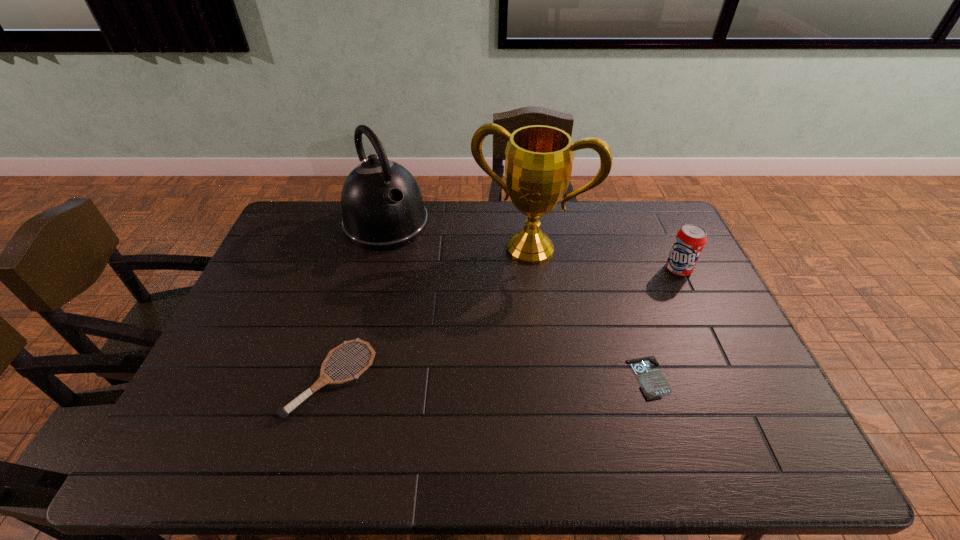
Where is `tennis racket that is positioned at the near edge`? The image size is (960, 540). tennis racket that is positioned at the near edge is located at coordinates (283, 412).

Locate an element on the screen. The width and height of the screenshot is (960, 540). identity card located at the near edge is located at coordinates (654, 385).

Where is `object located in the right edge section of the desktop`? The image size is (960, 540). object located in the right edge section of the desktop is located at coordinates (690, 240).

In the image, there is a desktop. Where is `vacant area at the far edge`? This screenshot has height=540, width=960. vacant area at the far edge is located at coordinates (517, 230).

The image size is (960, 540). Find the location of `free spot at the near edge of the desktop`. free spot at the near edge of the desktop is located at coordinates (296, 420).

Where is `vacant point at the left edge`? This screenshot has width=960, height=540. vacant point at the left edge is located at coordinates (267, 254).

In the image, there is a desktop. Identify the location of free space at the far left corner. This screenshot has width=960, height=540. (307, 226).

Where is `vacant position at the near left corner of the desktop`? This screenshot has height=540, width=960. vacant position at the near left corner of the desktop is located at coordinates point(237,415).

Where is `vacant position at the far right corner of the desktop`? The width and height of the screenshot is (960, 540). vacant position at the far right corner of the desktop is located at coordinates (625, 206).

Where is `vacant space at the near right corner`? The width and height of the screenshot is (960, 540). vacant space at the near right corner is located at coordinates (724, 400).